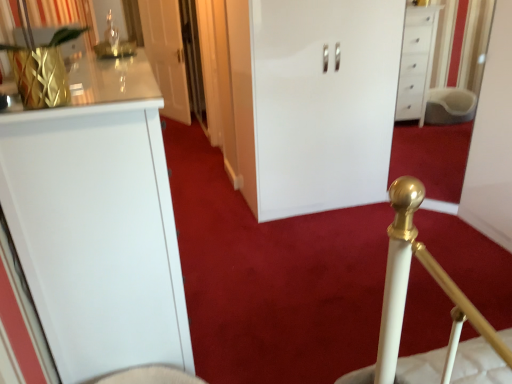
Find the location of a particular element. white glossy door at upper center, the 2th door in the right-to-left sequence is located at coordinates (166, 55).

Does white glossy cabinet at center, which appears as the first door when viewed from the front, have a larger size compared to white glossy door at upper center, which appears as the first door when viewed from the left?

Indeed, white glossy cabinet at center, which appears as the first door when viewed from the front, has a larger size compared to white glossy door at upper center, which appears as the first door when viewed from the left.

From a real-world perspective, who is located higher, white glossy cabinet at center, which appears as the first door when viewed from the front, or white glossy door at upper center, which is the first door in back-to-front order?

white glossy door at upper center, which is the first door in back-to-front order, is physically above.

Which of these two, white glossy cabinet at center, arranged as the 2th door when viewed from the back, or white glossy door at upper center, the 2th door positioned from the front, is wider?

white glossy cabinet at center, arranged as the 2th door when viewed from the back.

Are white glossy cabinet at center, which is counted as the first door, starting from the right, and white glossy door at upper center, the 2th door positioned from the front, located far from each other?

Yes, white glossy cabinet at center, which is counted as the first door, starting from the right, and white glossy door at upper center, the 2th door positioned from the front, are quite far apart.

Can you confirm if white glossy cabinet at center, arranged as the 2th door when viewed from the back, is thinner than gold metallic curtain at upper left?

In fact, white glossy cabinet at center, arranged as the 2th door when viewed from the back, might be wider than gold metallic curtain at upper left.

Which of these two, white glossy cabinet at center, arranged as the 2th door when viewed from the back, or gold metallic curtain at upper left, stands shorter?

Standing shorter between the two is gold metallic curtain at upper left.

Which of these two, white glossy cabinet at center, which ranks as the 2th door in left-to-right order, or gold metallic curtain at upper left, is bigger?

white glossy cabinet at center, which ranks as the 2th door in left-to-right order.

Considering the points (146, 48) and (7, 6), which point is in front, point (146, 48) or point (7, 6)?

The point (7, 6) is more forward.

Can you confirm if white glossy door at upper center, which appears as the first door when viewed from the left, is thinner than gold metallic curtain at upper left?

Correct, the width of white glossy door at upper center, which appears as the first door when viewed from the left, is less than that of gold metallic curtain at upper left.

Is white glossy door at upper center, which is the first door in back-to-front order, closer to the viewer compared to gold metallic curtain at upper left?

No, it is not.

Considering the positions of objects white glossy door at upper center, which is the first door in back-to-front order, and gold metallic curtain at upper left in the image provided, who is more to the right, white glossy door at upper center, which is the first door in back-to-front order, or gold metallic curtain at upper left?

gold metallic curtain at upper left.

Is gold metallic curtain at upper left to the left of white glossy door at upper center, which appears as the first door when viewed from the left, from the viewer's perspective?

In fact, gold metallic curtain at upper left is to the right of white glossy door at upper center, which appears as the first door when viewed from the left.

Is gold metallic curtain at upper left wider or thinner than white glossy door at upper center, the 2th door in the right-to-left sequence?

In the image, gold metallic curtain at upper left appears to be wider than white glossy door at upper center, the 2th door in the right-to-left sequence.

Considering the relative sizes of gold metallic curtain at upper left and white glossy door at upper center, which appears as the first door when viewed from the left, in the image provided, is gold metallic curtain at upper left smaller than white glossy door at upper center, which appears as the first door when viewed from the left,?

Yes.

Could you tell me if white glossy door at upper center, which is the first door in back-to-front order, is turned towards white glossy cabinet at center, which ranks as the 2th door in left-to-right order?

No, white glossy door at upper center, which is the first door in back-to-front order, is not oriented towards white glossy cabinet at center, which ranks as the 2th door in left-to-right order.

Which is nearer, (183, 117) or (266, 20)?

Point (183, 117) appears to be farther away from the viewer than point (266, 20).

Which of these two, white glossy door at upper center, the 2th door positioned from the front, or white glossy cabinet at center, which appears as the first door when viewed from the front, is wider?

Wider between the two is white glossy cabinet at center, which appears as the first door when viewed from the front.

Which of these two, white glossy door at upper center, which is the first door in back-to-front order, or white glossy cabinet at center, which ranks as the 2th door in left-to-right order, is smaller?

white glossy door at upper center, which is the first door in back-to-front order, is smaller.

Can you confirm if gold metallic curtain at upper left is shorter than white glossy cabinet at center, arranged as the 2th door when viewed from the back?

Correct, gold metallic curtain at upper left is not as tall as white glossy cabinet at center, arranged as the 2th door when viewed from the back.

Which of these two, gold metallic curtain at upper left or white glossy cabinet at center, which appears as the first door when viewed from the front, is wider?

With larger width is white glossy cabinet at center, which appears as the first door when viewed from the front.

From the image's perspective, is gold metallic curtain at upper left beneath white glossy cabinet at center, which ranks as the 2th door in left-to-right order?

Correct, gold metallic curtain at upper left appears lower than white glossy cabinet at center, which ranks as the 2th door in left-to-right order, in the image.

Does gold metallic curtain at upper left appear on the left side of white glossy cabinet at center, which ranks as the 2th door in left-to-right order?

Indeed, gold metallic curtain at upper left is positioned on the left side of white glossy cabinet at center, which ranks as the 2th door in left-to-right order.

You are a GUI agent. You are given a task and a screenshot of the screen. Output one action in this format:
    pyautogui.click(x=<x>, y=<y>)
    Task: Click on the door that appears in front of the white glossy door at upper center, the 2th door in the right-to-left sequence
    The image size is (512, 384).
    Given the screenshot: What is the action you would take?
    pyautogui.click(x=323, y=102)

I want to click on curtain below the white glossy cabinet at center, which appears as the first door when viewed from the front (from the image's perspective), so click(x=59, y=13).

Which object lies nearer to the anchor point gold metallic curtain at upper left, white glossy door at upper center, the 2th door in the right-to-left sequence, or white glossy cabinet at center, which is counted as the first door, starting from the right?

white glossy cabinet at center, which is counted as the first door, starting from the right, lies closer to gold metallic curtain at upper left than the other object.

Considering their positions, is white glossy cabinet at center, which appears as the first door when viewed from the front, positioned further to white glossy door at upper center, which is the first door in back-to-front order, than gold metallic curtain at upper left?

Among the two, white glossy cabinet at center, which appears as the first door when viewed from the front, is located further to white glossy door at upper center, which is the first door in back-to-front order.

Looking at the image, which one is located further to white glossy cabinet at center, arranged as the 2th door when viewed from the back, white glossy door at upper center, which appears as the first door when viewed from the left, or gold metallic curtain at upper left?

white glossy door at upper center, which appears as the first door when viewed from the left, is positioned further to the anchor white glossy cabinet at center, arranged as the 2th door when viewed from the back.

When comparing their distances from gold metallic curtain at upper left, does white glossy cabinet at center, arranged as the 2th door when viewed from the back, or white glossy door at upper center, the 2th door positioned from the front, seem further?

white glossy door at upper center, the 2th door positioned from the front, is further to gold metallic curtain at upper left.

Considering their positions, is gold metallic curtain at upper left positioned further to white glossy door at upper center, the 2th door in the right-to-left sequence, than white glossy cabinet at center, which is counted as the first door, starting from the right?

white glossy cabinet at center, which is counted as the first door, starting from the right.

Which object lies nearer to the anchor point white glossy cabinet at center, which is counted as the first door, starting from the right, gold metallic curtain at upper left or white glossy door at upper center, which appears as the first door when viewed from the left?

gold metallic curtain at upper left lies closer to white glossy cabinet at center, which is counted as the first door, starting from the right, than the other object.

Identify the location of door between gold metallic curtain at upper left and white glossy door at upper center, which is the first door in back-to-front order, along the z-axis. The height and width of the screenshot is (384, 512). (323, 102).